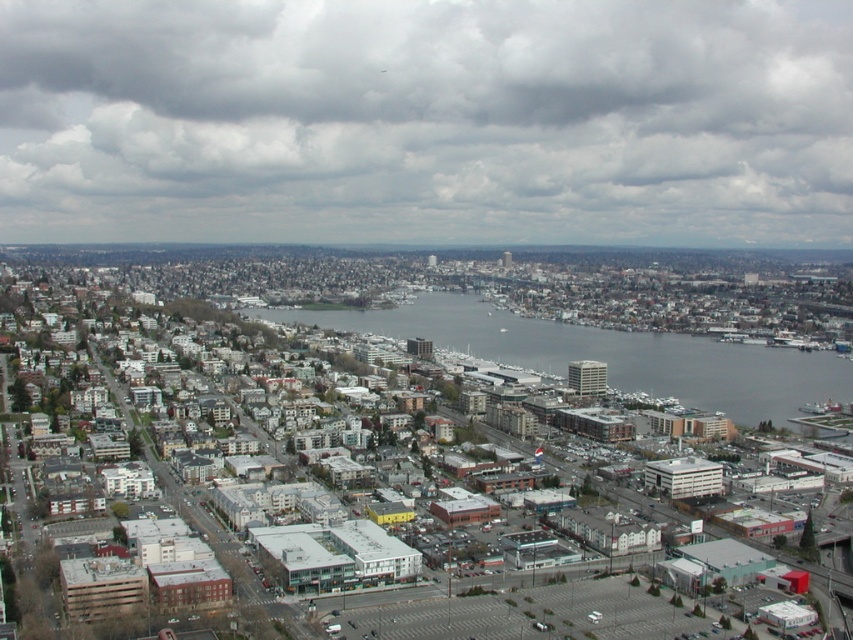
You are a drone operator trying to capture a photo of the cloudy sky at upper center in the city scene. The drone has a maximum flight range of 0.2 units from your current position at point 0.3, 0.5. Can the drone reach the cloudy sky at upper center located at point (426,122)?

The cloudy sky at upper center is located at point (426,122), which is within the drone operator current position at 0.3, 0.5 with a maximum flight range of 0.2 units. The distance between the two points is sqrt. The distance between the two points is sqrt. The distance between the two points is sqrt. The distance between the two points is sqrt. The distance between the two points is sqrt. The distance between the two points is sqrt. The distance between the two points is sqrt. The distance between the 0

You are a drone operator who needs to fly a drone from the cloudy sky at upper center to the gray water at center. What is the vertical distance the drone must descend?

The cloudy sky at upper center is 146.30 meters above the gray water at center, so the drone must descend 146.30 meters to reach the gray water at center.